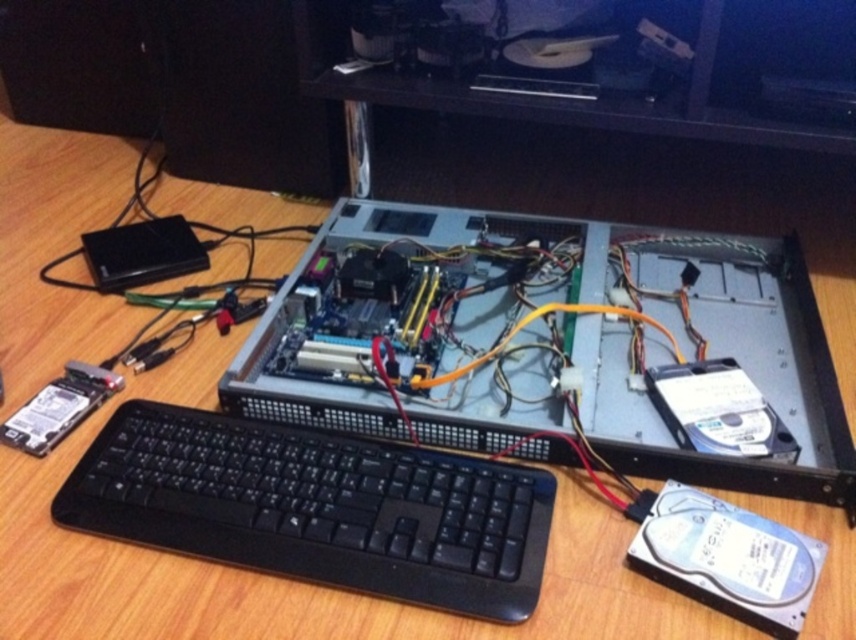
Is point (337, 422) behind point (107, 422)?

That is False.

Measure the distance between silver metallic computer at center and black plastic keyboard at lower left.

silver metallic computer at center and black plastic keyboard at lower left are 7.57 inches apart from each other.

Is point (780, 369) farther from viewer compared to point (367, 552)?

Yes, it is.

Image resolution: width=856 pixels, height=640 pixels. Identify the location of silver metallic computer at center. (557, 346).